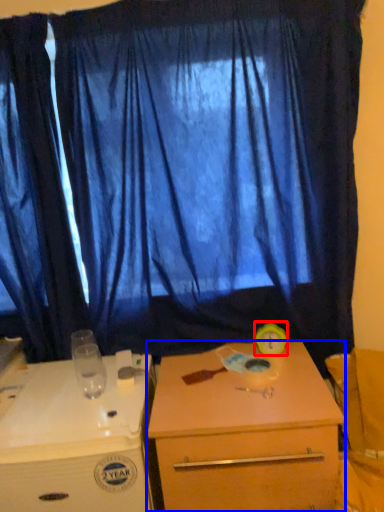
Question: Among these objects, which one is nearest to the camera, alarm clock (highlighted by a red box) or desk (highlighted by a blue box)?

Choices:
 (A) alarm clock
 (B) desk

Answer: (B)